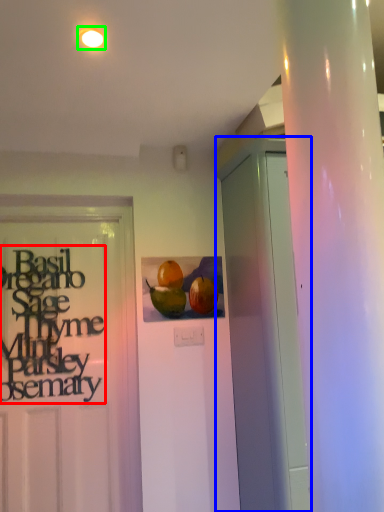
Question: Which is nearer to the lettering (highlighted by a red box)? garage door (highlighted by a blue box) or lighting (highlighted by a green box).

Choices:
 (A) garage door
 (B) lighting

Answer: (A)